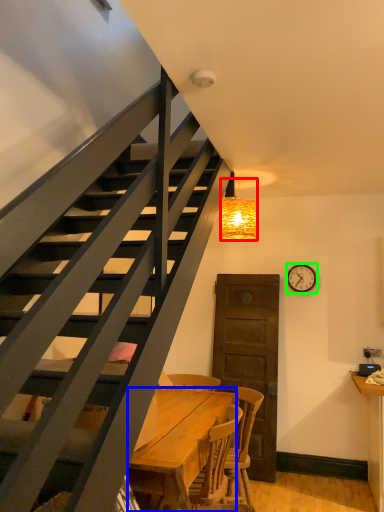
Question: Which object is the farthest from lamp (highlighted by a red box)? Choose among these: desk (highlighted by a blue box) or clock (highlighted by a green box).

Choices:
 (A) desk
 (B) clock

Answer: (A)